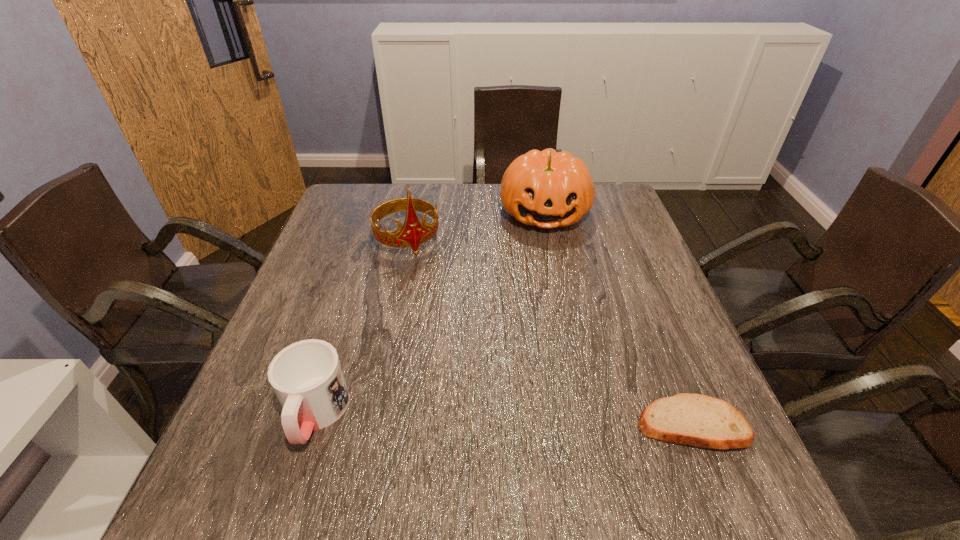
Identify the location of free space on the desktop that is between the third tallest object and the shortest object and is positioned on the front-facing side of the tiara. (494, 419).

The width and height of the screenshot is (960, 540). I want to click on vacant spot on the desktop that is between the third tallest object and the pita bread and is positioned on the carved face of the pumpkin, so click(x=559, y=421).